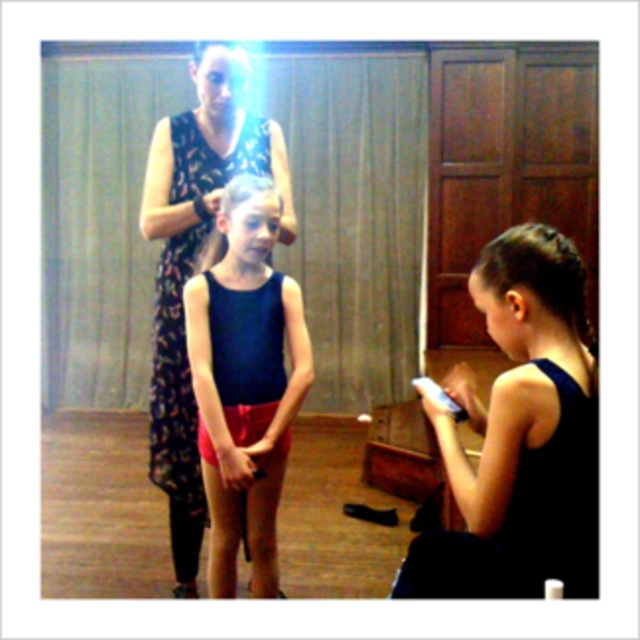
You are a photographer setting up for a dance class photo shoot. You need to position two dancers with their hair visible. The dancers have black shiny hair at right and blonde silky hair at upper center. Based on their current positions, which dancer with which hair type is positioned to the right of the other?

The black shiny hair at right is positioned on the right side of blonde silky hair at upper center, so the dancer with black shiny hair at right is to the right of the blonde silky hair at upper center.

You are a photographer setting up for a dance class photo shoot in a studio. You notice two strands of blonde silky hair in the frame. The first is at the center, and the second is at the upper center. The camera you are using has a depth of field that can sharply focus on objects within 15 inches. Can both the blonde silky hair at center and the blonde silky hair at upper center be in focus at the same time?

The blonde silky hair at center is 17.19 inches away from the blonde silky hair at upper center. Since the depth of field can only focus on objects within 15 inches, the distance between them exceeds this limit. Therefore, both cannot be in focus simultaneously.

You are standing in a dance studio and see a point at coordinates (520, 435). Which object is this point located on?

The point at (520, 435) is located on the matte black tank top at lower right.